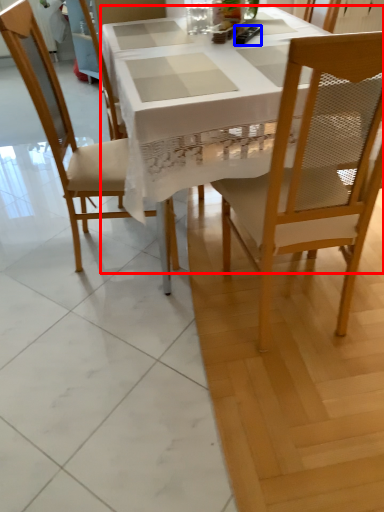
Question: Which point is closer to the camera, desk (highlighted by a red box) or remote control (highlighted by a blue box)?

Choices:
 (A) desk
 (B) remote control

Answer: (A)